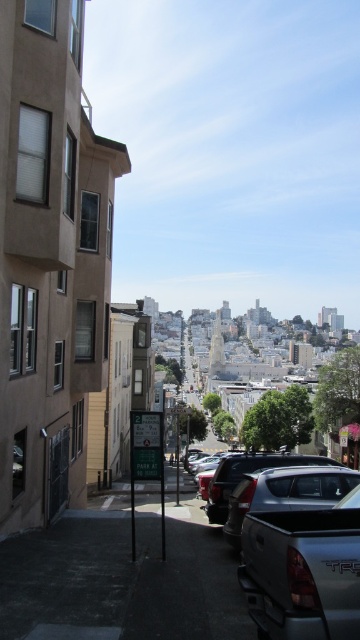
The height and width of the screenshot is (640, 360). What do you see at coordinates (261, 493) in the screenshot?
I see `silver metallic truck at lower right` at bounding box center [261, 493].

Between silver metallic truck at lower right and metallic silver parking sign at center, which one has less height?

silver metallic truck at lower right is shorter.

What are the coordinates of `silver metallic truck at lower right` in the screenshot? It's located at (261, 493).